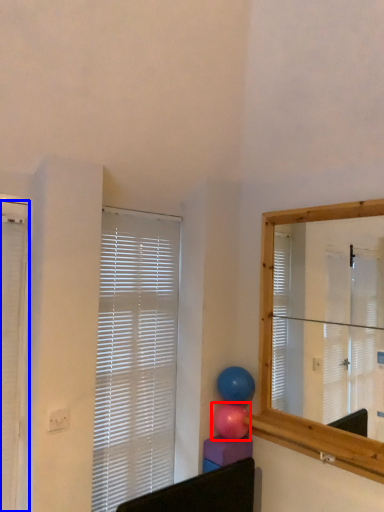
Question: Which of the following is the farthest to the observer, balloon (highlighted by a red box) or window blind (highlighted by a blue box)?

Choices:
 (A) balloon
 (B) window blind

Answer: (A)